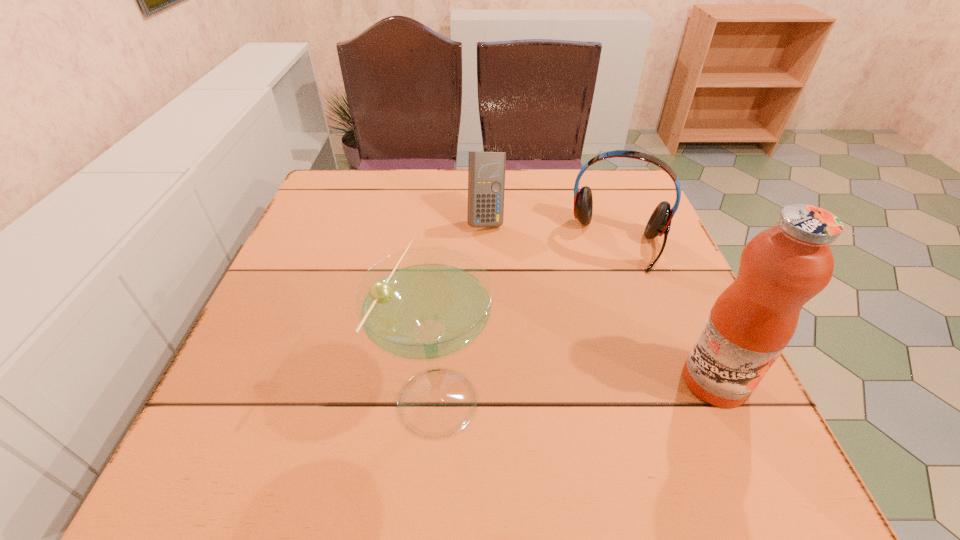
I want to click on the third shortest object, so click(x=425, y=304).

Locate an element on the screen. The image size is (960, 540). the tallest object is located at coordinates (781, 268).

At what (x,y) coordinates should I click in order to perform the action: click on calculator. Please return your answer as a coordinate pair (x, y). Looking at the image, I should click on (486, 170).

You are a GUI agent. You are given a task and a screenshot of the screen. Output one action in this format:
    pyautogui.click(x=<x>, y=<y>)
    Task: Click on the headset
    The image size is (960, 540).
    Given the screenshot: What is the action you would take?
    pyautogui.click(x=659, y=223)

Find the location of a particular element. This screenshot has width=960, height=540. free space located on the back of the third shortest object is located at coordinates [x=446, y=293].

At what (x,y) coordinates should I click in order to perform the action: click on vacant region located on the front-facing side of the calculator. Please return your answer as a coordinate pair (x, y). This screenshot has width=960, height=540. Looking at the image, I should click on (529, 338).

At what (x,y) coordinates should I click in order to perform the action: click on vacant space located on the front-facing side of the calculator. Please return your answer as a coordinate pair (x, y). Looking at the image, I should click on (519, 312).

You are a GUI agent. You are given a task and a screenshot of the screen. Output one action in this format:
    pyautogui.click(x=<x>, y=<y>)
    Task: Click on the blank area located 0.200m on the front-facing side of the calculator
    
    Given the screenshot: What is the action you would take?
    click(512, 291)

The width and height of the screenshot is (960, 540). In order to click on free space located 0.310m with the microphone attached to the side of the headset in this screenshot , I will do `click(586, 384)`.

Locate an element on the screen. The image size is (960, 540). free location located with the microphone attached to the side of the headset is located at coordinates (584, 393).